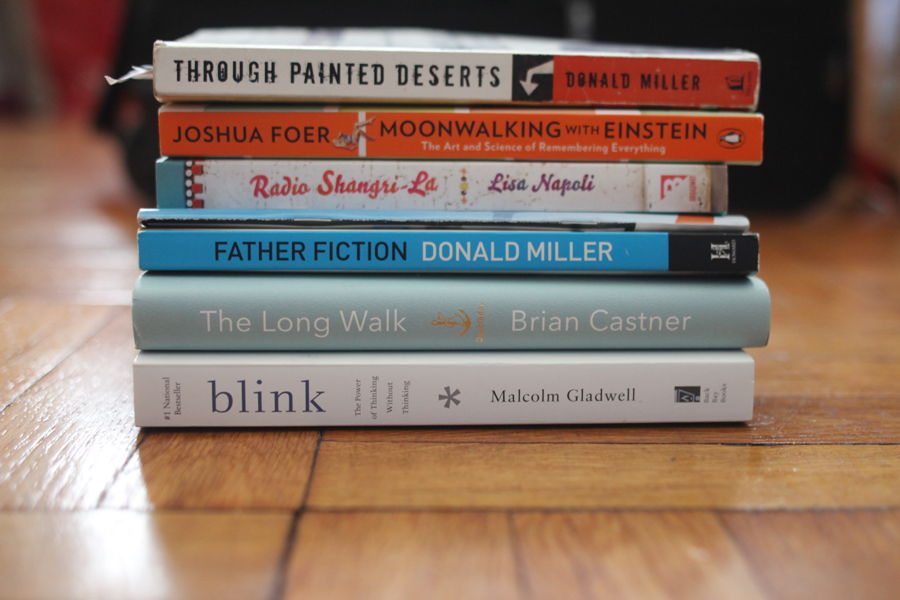
The image size is (900, 600). Identify the location of spine of book. (480, 400), (472, 342), (479, 259), (480, 217), (477, 192), (477, 150), (482, 85).